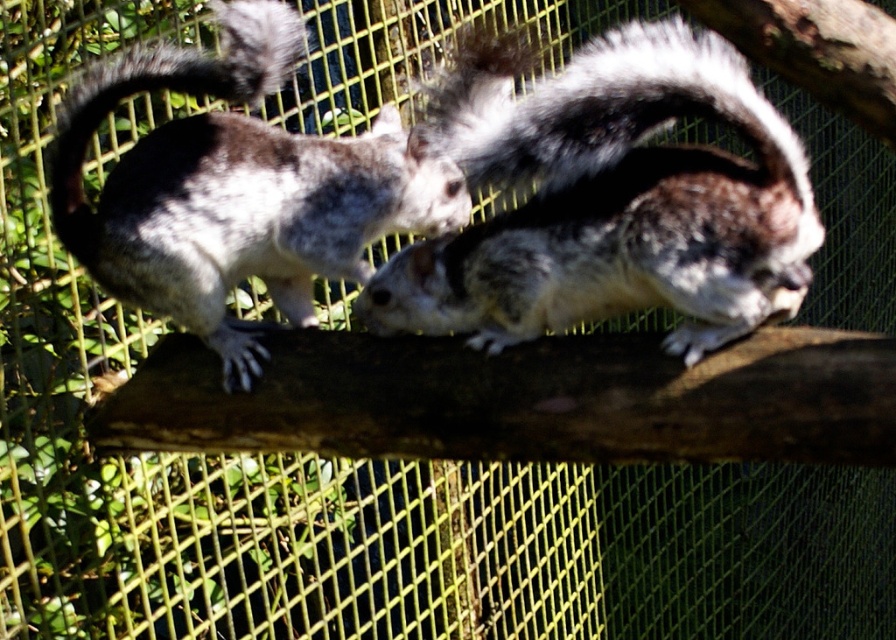
Question: Does gray-furred squirrel at center have a smaller size compared to gray-furred tail at upper left?

Choices:
 (A) yes
 (B) no

Answer: (B)

Question: Can you confirm if gray-furred squirrel at center is positioned to the left of gray-furred tail at upper left?

Choices:
 (A) no
 (B) yes

Answer: (A)

Question: Observing the image, what is the correct spatial positioning of gray-furred squirrel at center in reference to gray-furred tail at upper left?

Choices:
 (A) above
 (B) below

Answer: (B)

Question: Based on their relative distances, which object is nearer to the speckled fur squirrel at left?

Choices:
 (A) gray-furred squirrel at center
 (B) gray-furred tail at upper left

Answer: (B)

Question: Which of these objects is positioned farthest from the gray-furred squirrel at center?

Choices:
 (A) speckled fur squirrel at left
 (B) gray-furred tail at upper left

Answer: (B)

Question: Which object is farther from the camera taking this photo?

Choices:
 (A) gray-furred tail at upper left
 (B) speckled fur squirrel at left

Answer: (A)